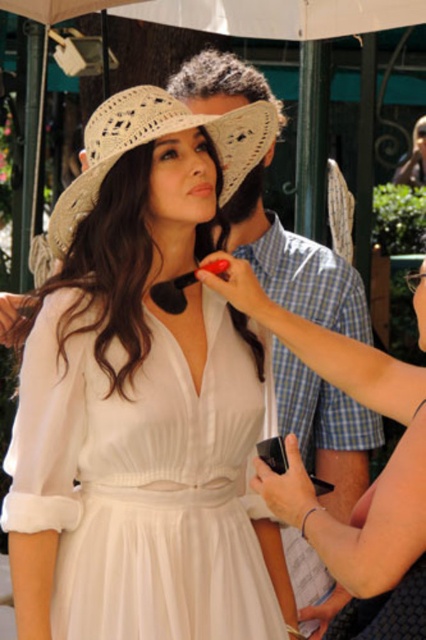
Between white matte dress at center and woven straw hat at upper center, which one appears on the left side from the viewer's perspective?

Positioned to the left is woven straw hat at upper center.

How much distance is there between white matte dress at center and woven straw hat at upper center?

A distance of 28.06 inches exists between white matte dress at center and woven straw hat at upper center.

Between point (216, 284) and point (88, 120), which one is positioned in front?

Point (216, 284) is more forward.

Locate an element on the screen. white matte dress at center is located at coordinates point(377,477).

Which is above, white chiffon dress at center or white matte dress at center?

Positioned higher is white matte dress at center.

Is point (57, 560) more distant than point (423, 465)?

That is True.

What are the coordinates of `white chiffon dress at center` in the screenshot? It's located at (144, 484).

How distant is white chiffon dress at center from woven straw hat at upper center?

The distance of white chiffon dress at center from woven straw hat at upper center is 29.49 inches.

Is white chiffon dress at center wider than woven straw hat at upper center?

Indeed, white chiffon dress at center has a greater width compared to woven straw hat at upper center.

The height and width of the screenshot is (640, 426). Describe the element at coordinates (144, 484) in the screenshot. I see `white chiffon dress at center` at that location.

The height and width of the screenshot is (640, 426). In order to click on white chiffon dress at center in this screenshot , I will do `click(144, 484)`.